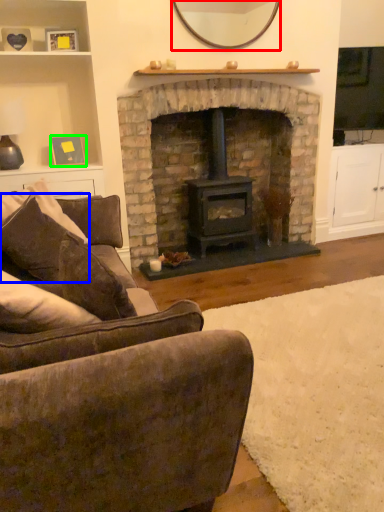
Question: Considering the real-world distances, which object is closest to mirror (highlighted by a red box)? pillow (highlighted by a blue box) or picture frame (highlighted by a green box).

Choices:
 (A) pillow
 (B) picture frame

Answer: (B)